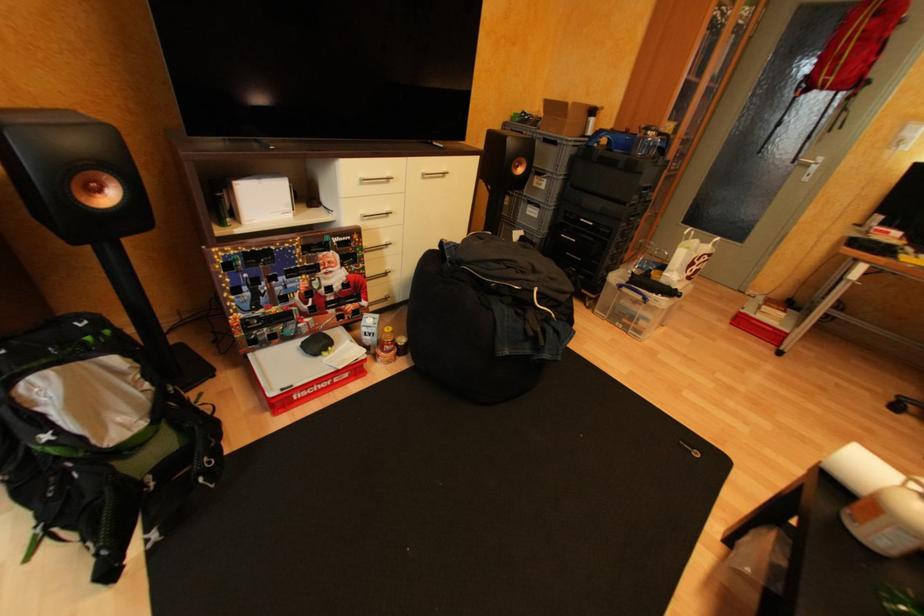
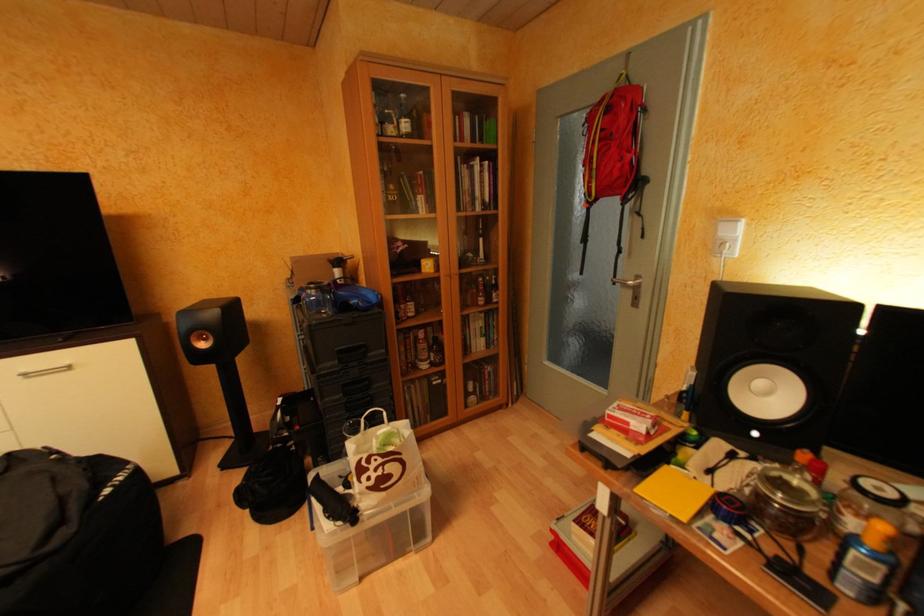
Question: What movement of the cameraman would produce the second image?

Choices:
 (A) Left
 (B) Right
 (C) Forward
 (D) Backward

Answer: (B)